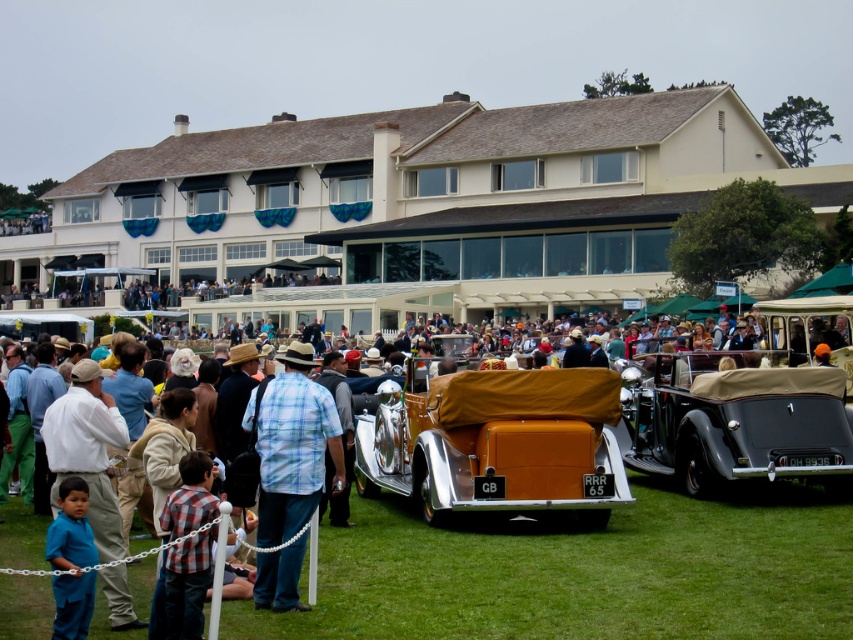
Question: Is green grass at lower center smaller than gold leather car at center?

Choices:
 (A) no
 (B) yes

Answer: (A)

Question: Does gold leather car at center have a smaller size compared to blue cotton shirt at lower left?

Choices:
 (A) no
 (B) yes

Answer: (B)

Question: Which point appears farthest from the camera in this image?

Choices:
 (A) (62, 625)
 (B) (314, 388)

Answer: (B)

Question: Among these points, which one is nearest to the camera?

Choices:
 (A) click(196, 496)
 (B) click(289, 417)
 (C) click(64, 630)

Answer: (C)

Question: Is the position of matte black convertible at center less distant than that of plaid shirt at center?

Choices:
 (A) yes
 (B) no

Answer: (B)

Question: Which object appears closest to the camera in this image?

Choices:
 (A) gold leather car at center
 (B) blue cotton shirt at lower left

Answer: (B)